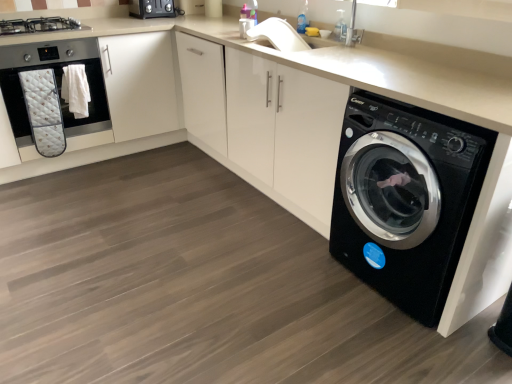
Question: Can you confirm if black glossy washing machine at lower right is wider than satin black toaster at upper center?

Choices:
 (A) yes
 (B) no

Answer: (A)

Question: Considering the relative sizes of black glossy washing machine at lower right and satin black toaster at upper center in the image provided, is black glossy washing machine at lower right taller than satin black toaster at upper center?

Choices:
 (A) no
 (B) yes

Answer: (B)

Question: Does black glossy washing machine at lower right come behind satin black toaster at upper center?

Choices:
 (A) yes
 (B) no

Answer: (B)

Question: Is black glossy washing machine at lower right thinner than satin black toaster at upper center?

Choices:
 (A) yes
 (B) no

Answer: (B)

Question: From a real-world perspective, is black glossy washing machine at lower right below satin black toaster at upper center?

Choices:
 (A) no
 (B) yes

Answer: (B)

Question: From the image's perspective, is satin black stove at upper left positioned above or below black glossy washing machine at lower right?

Choices:
 (A) above
 (B) below

Answer: (A)

Question: From a real-world perspective, relative to black glossy washing machine at lower right, is satin black stove at upper left vertically above or below?

Choices:
 (A) above
 (B) below

Answer: (A)

Question: Considering the positions of satin black stove at upper left and black glossy washing machine at lower right in the image, is satin black stove at upper left wider or thinner than black glossy washing machine at lower right?

Choices:
 (A) thin
 (B) wide

Answer: (A)

Question: Relative to black glossy washing machine at lower right, is satin black stove at upper left in front or behind?

Choices:
 (A) front
 (B) behind

Answer: (B)

Question: Is point (480, 183) positioned closer to the camera than point (155, 3)?

Choices:
 (A) farther
 (B) closer

Answer: (B)

Question: Based on their positions, is black glossy washing machine at lower right located to the left or right of satin black toaster at upper center?

Choices:
 (A) right
 (B) left

Answer: (A)

Question: From the image's perspective, is black glossy washing machine at lower right above or below satin black toaster at upper center?

Choices:
 (A) above
 (B) below

Answer: (B)

Question: From a real-world perspective, is black glossy washing machine at lower right physically located above or below satin black toaster at upper center?

Choices:
 (A) below
 (B) above

Answer: (A)

Question: Is matte black oven at left taller or shorter than satin black toaster at upper center?

Choices:
 (A) tall
 (B) short

Answer: (A)

Question: Choose the correct answer: Is matte black oven at left inside satin black toaster at upper center or outside it?

Choices:
 (A) inside
 (B) outside

Answer: (B)